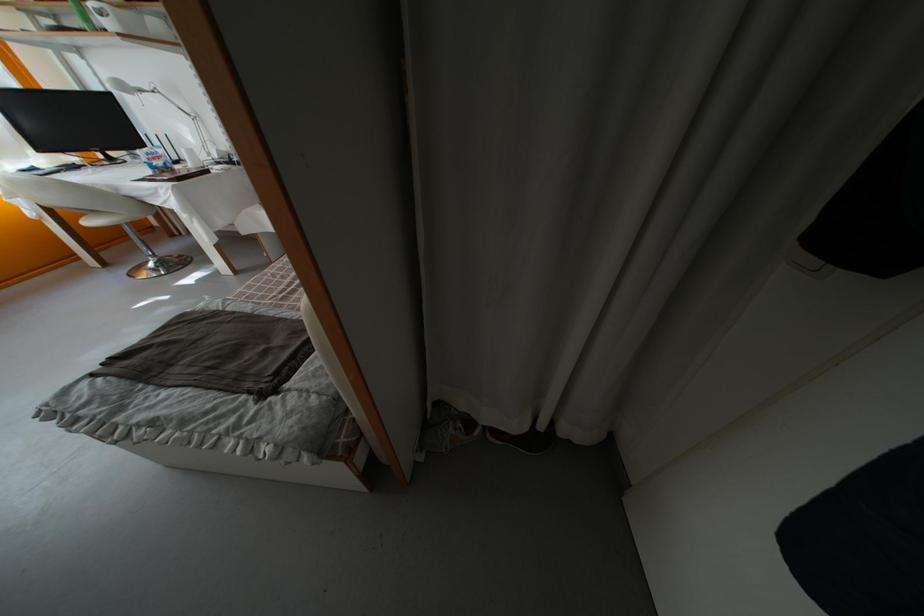
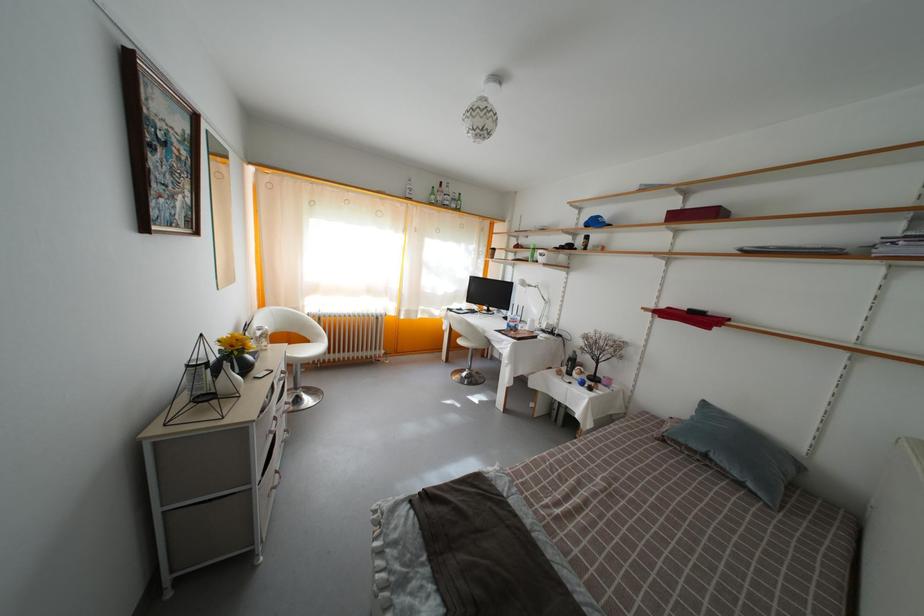
Find the pixel in the second image that matches [139,91] in the first image.

(533, 289)